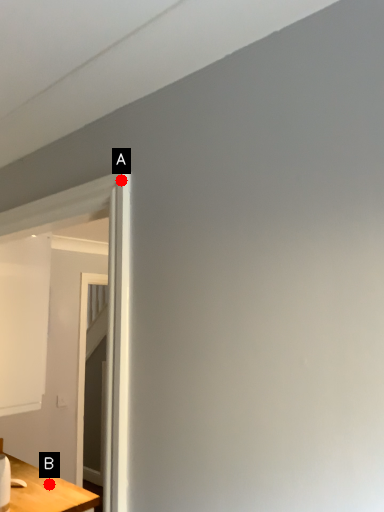
Question: Two points are circled on the image, labeled by A and B beside each circle. Among these points, which one is nearest to the camera?

Choices:
 (A) A is closer
 (B) B is closer

Answer: (A)